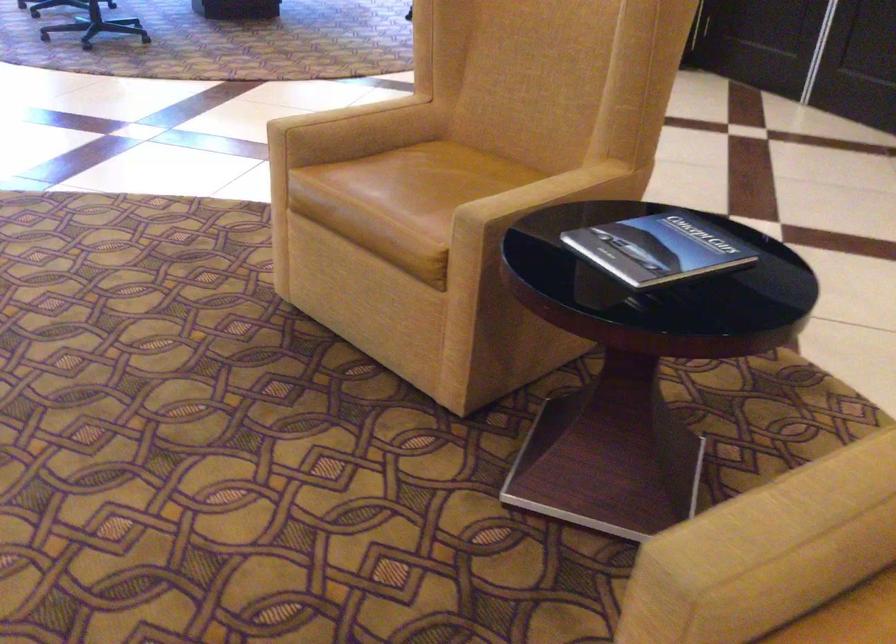
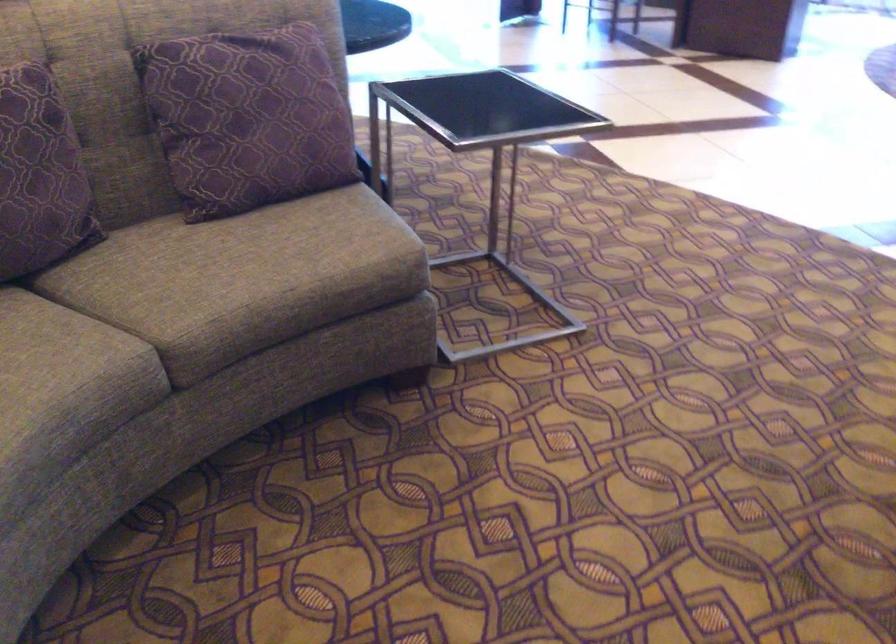
Question: The camera is either moving clockwise (left) or counter-clockwise (right) around the object. The first image is from the beginning of the video and the second image is from the end. Is the camera moving left or right when shooting the video?

Choices:
 (A) Left
 (B) Right

Answer: (B)